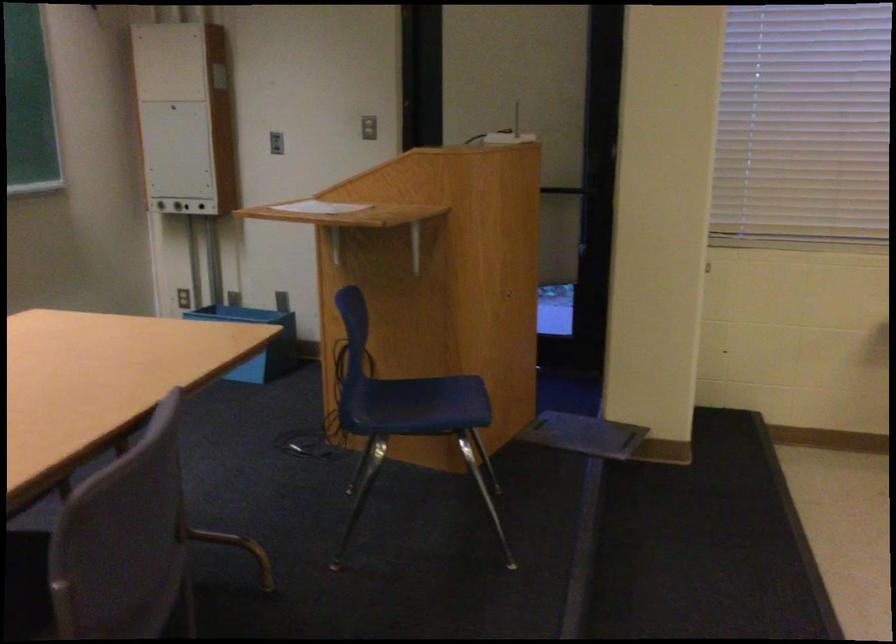
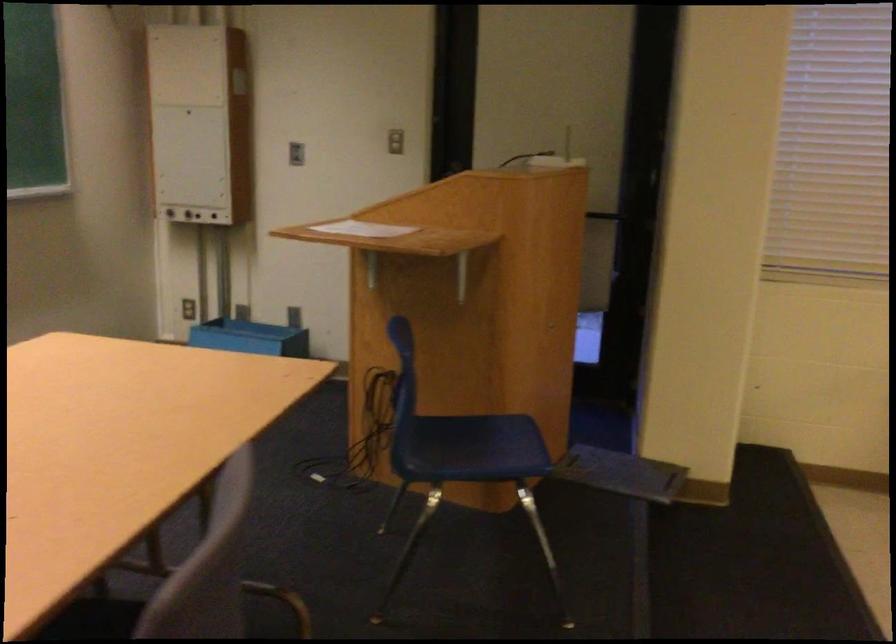
Question: I am providing you with two images of the same scene from different viewpoints. Which of the following objects are not visible in image2?

Choices:
 (A) control panel knob
 (B) white router box
 (C) blue plastic bin
 (D) none of these

Answer: (D)